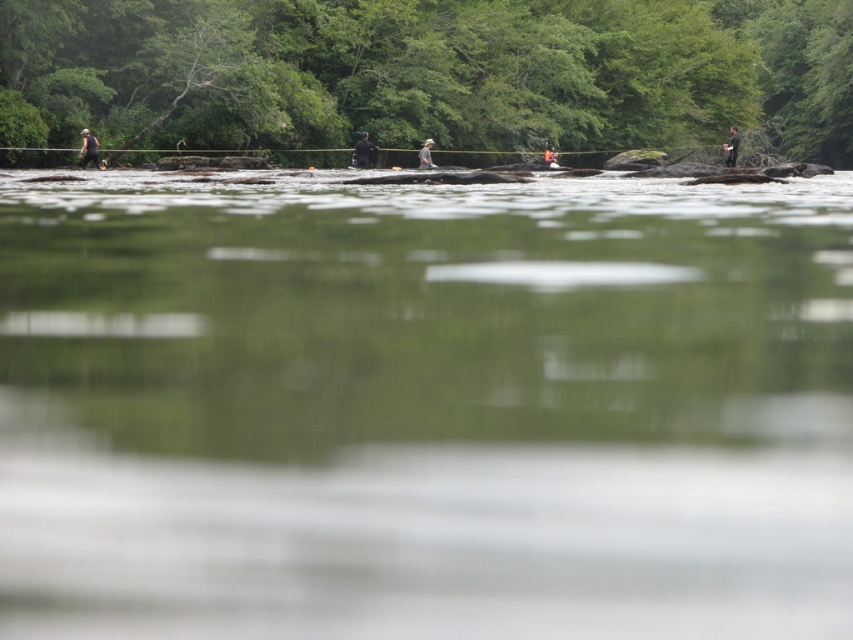
Question: Which of the following is the farthest from the observer?

Choices:
 (A) (726, 148)
 (B) (424, 157)
 (C) (352, 163)

Answer: (A)

Question: Estimate the real-world distances between objects in this image. Which object is farther from the black matte jacket at upper right?

Choices:
 (A) orange life vest at center
 (B) green leafy tree at upper center

Answer: (B)

Question: In this image, where is green smooth water at center located relative to green leafy tree at upper center?

Choices:
 (A) below
 (B) above

Answer: (A)

Question: Observing the image, what is the correct spatial positioning of green leafy tree at upper center in reference to orange life vest at center?

Choices:
 (A) left
 (B) right

Answer: (B)

Question: Does black matte jacket at center appear on the left side of dark gray fabric jacket at center?

Choices:
 (A) yes
 (B) no

Answer: (A)

Question: Estimate the real-world distances between objects in this image. Which object is closer to the dark gray fabric jacket at left?

Choices:
 (A) green leafy tree at upper center
 (B) dark gray fabric jacket at center

Answer: (B)